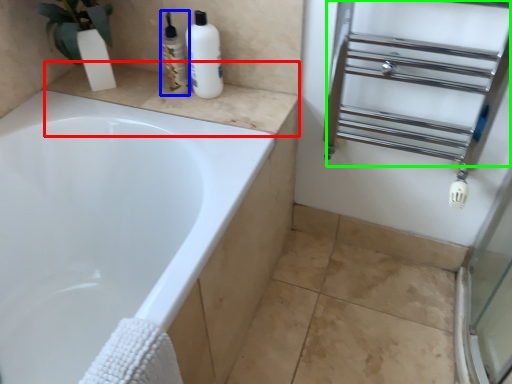
Question: Estimate the real-world distances between objects in this image. Which object is closer to counter top (highlighted by a red box), toiletry (highlighted by a blue box) or shelf (highlighted by a green box)?

Choices:
 (A) toiletry
 (B) shelf

Answer: (A)